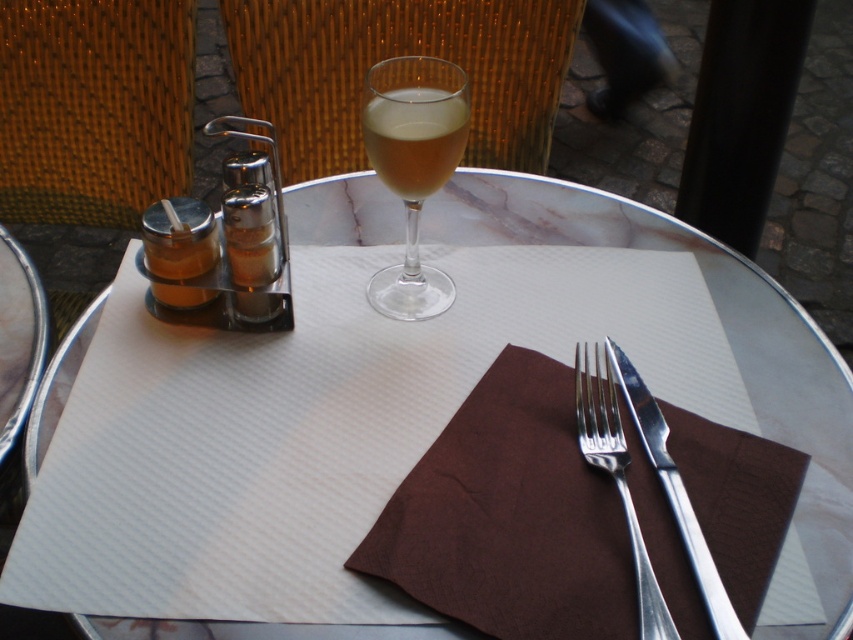
Question: Can you confirm if brown paper napkin at center is thinner than translucent glass at center?

Choices:
 (A) no
 (B) yes

Answer: (A)

Question: Which point appears closest to the camera in this image?

Choices:
 (A) (430, 621)
 (B) (627, 385)
 (C) (381, 102)

Answer: (A)

Question: Is white marble table at center positioned before polished metal fork at center-right?

Choices:
 (A) no
 (B) yes

Answer: (A)

Question: Is brown paper napkin at center below silver metallic fork at center?

Choices:
 (A) yes
 (B) no

Answer: (A)

Question: Which is nearer to the clear glass wine glass at center?

Choices:
 (A) translucent glass at center
 (B) polished metal fork at center-right

Answer: (A)

Question: Which of these objects is positioned farthest from the white marble table at center?

Choices:
 (A) clear glass wine glass at center
 (B) silver metallic fork at center

Answer: (B)